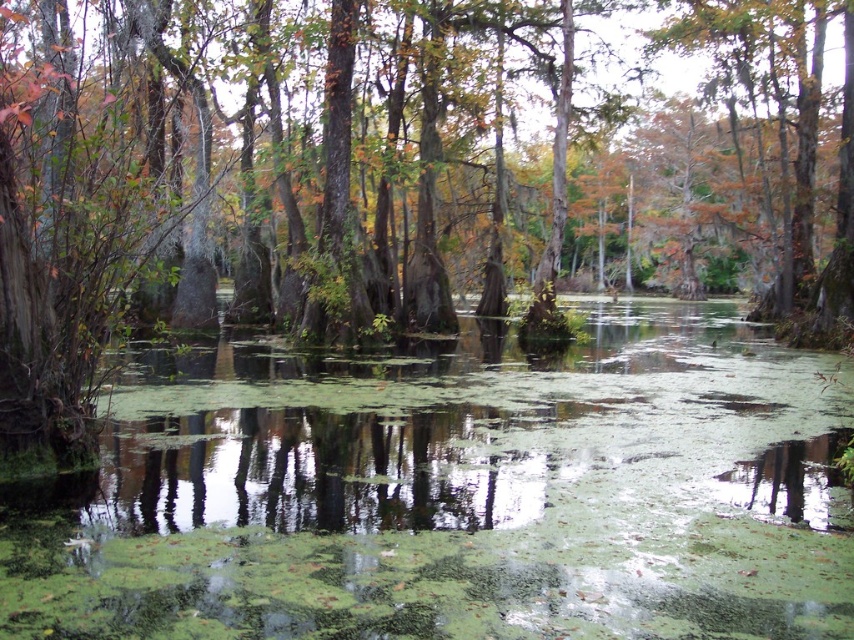
You are standing on a wooden boardwalk observing the swamp scene. You notice the green algae water at center and the green mossy tree at center. Which object is nearer to you?

The green algae water at center is closer to the viewer than the green mossy tree at center, so the green algae water at center is nearer to you.

You are standing on a wooden boardwalk that is 20 feet long. You want to reach the green algae water at center to take a sample. Can you reach it without stepping off the boardwalk?

The green algae water at center is 19.73 feet away from viewer, so yes, you can reach it without stepping off the boardwalk since it is within the 20 feet length of the boardwalk.